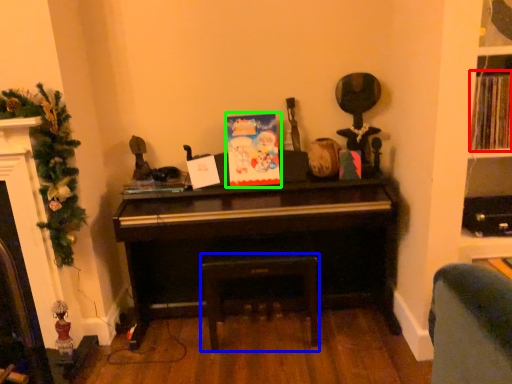
Question: Considering the real-world distances, which object is closest to book (highlighted by a red box)? stool (highlighted by a blue box) or christmas card (highlighted by a green box).

Choices:
 (A) stool
 (B) christmas card

Answer: (B)